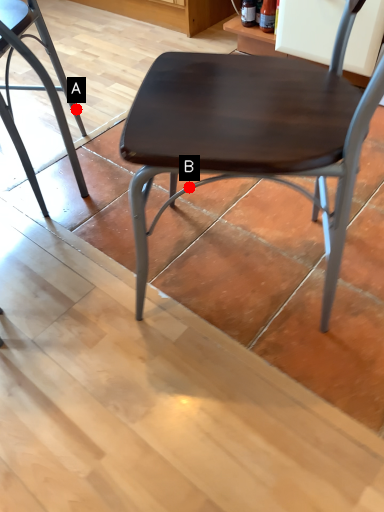
Question: Two points are circled on the image, labeled by A and B beside each circle. Which of the following is the farthest from the observer?

Choices:
 (A) A is further
 (B) B is further

Answer: (A)